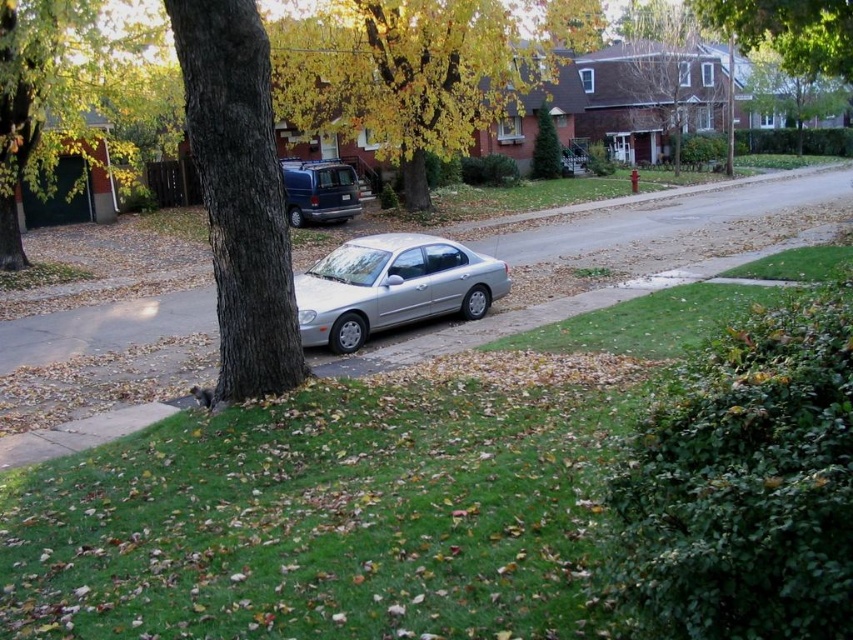
Question: Which object is positioned closest to the green leafy tree at upper center?

Choices:
 (A) brown wood tree at upper center
 (B) smooth bark tree at center
 (C) smooth brown tree trunk at left
 (D) matte blue van at center

Answer: (A)

Question: Can you confirm if yellow leafy tree at upper center is positioned below smooth bark tree at center?

Choices:
 (A) yes
 (B) no

Answer: (B)

Question: In this image, where is smooth brown tree trunk at left located relative to silver metallic sedan at center?

Choices:
 (A) above
 (B) below

Answer: (A)

Question: Which object is farther from the camera taking this photo?

Choices:
 (A) green leafy tree at upper center
 (B) smooth brown tree trunk at left

Answer: (A)

Question: Which of the following is the farthest from the observer?

Choices:
 (A) (299, 346)
 (B) (306, 161)

Answer: (B)

Question: Can you confirm if smooth bark tree at center is positioned above matte blue van at center?

Choices:
 (A) no
 (B) yes

Answer: (A)